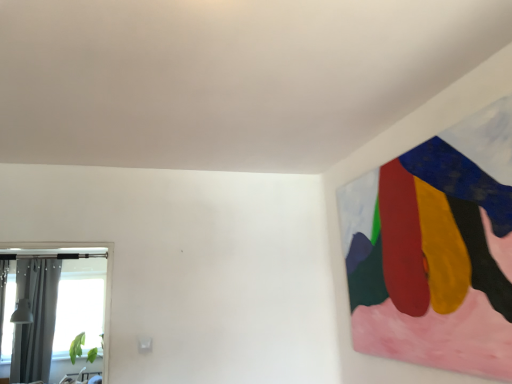
Question: From a real-world perspective, relative to clear glass window at left, is gray fabric curtain at left vertically above or below?

Choices:
 (A) below
 (B) above

Answer: (A)

Question: Is gray fabric curtain at left inside or outside of clear glass window at left?

Choices:
 (A) outside
 (B) inside

Answer: (A)

Question: Based on their positions, is gray fabric curtain at left located to the left or right of clear glass window at left?

Choices:
 (A) left
 (B) right

Answer: (B)

Question: Considering the positions of clear glass window at left and gray fabric curtain at left in the image, is clear glass window at left taller or shorter than gray fabric curtain at left?

Choices:
 (A) short
 (B) tall

Answer: (A)

Question: Is clear glass window at left wider or thinner than gray fabric curtain at left?

Choices:
 (A) thin
 (B) wide

Answer: (B)

Question: Considering the positions of point pyautogui.click(x=8, y=359) and point pyautogui.click(x=34, y=370), is point pyautogui.click(x=8, y=359) closer or farther from the camera than point pyautogui.click(x=34, y=370)?

Choices:
 (A) closer
 (B) farther

Answer: (A)

Question: From a real-world perspective, is clear glass window at left positioned above or below gray fabric curtain at left?

Choices:
 (A) above
 (B) below

Answer: (A)